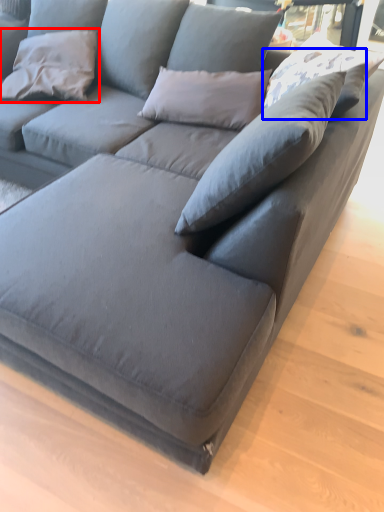
Question: Which object appears farthest to the camera in this image, pillow (highlighted by a red box) or pillow (highlighted by a blue box)?

Choices:
 (A) pillow
 (B) pillow

Answer: (A)